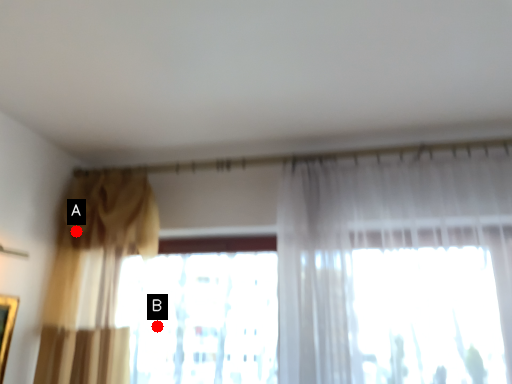
Question: Two points are circled on the image, labeled by A and B beside each circle. Which point is closer to the camera taking this photo?

Choices:
 (A) A is closer
 (B) B is closer

Answer: (A)